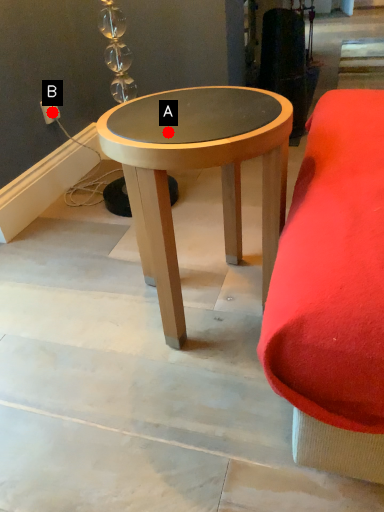
Question: Two points are circled on the image, labeled by A and B beside each circle. Which point appears closest to the camera in this image?

Choices:
 (A) A is closer
 (B) B is closer

Answer: (A)